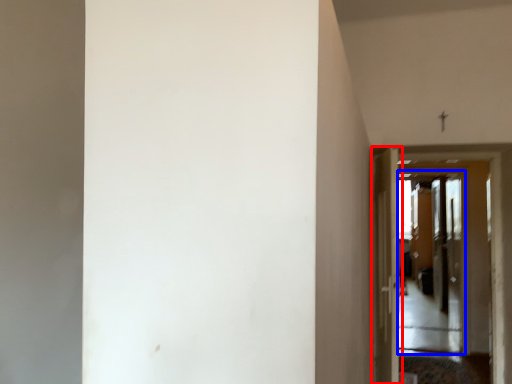
Question: Which of the following is the farthest to the observer, door (highlighted by a red box) or screen door (highlighted by a blue box)?

Choices:
 (A) door
 (B) screen door

Answer: (B)